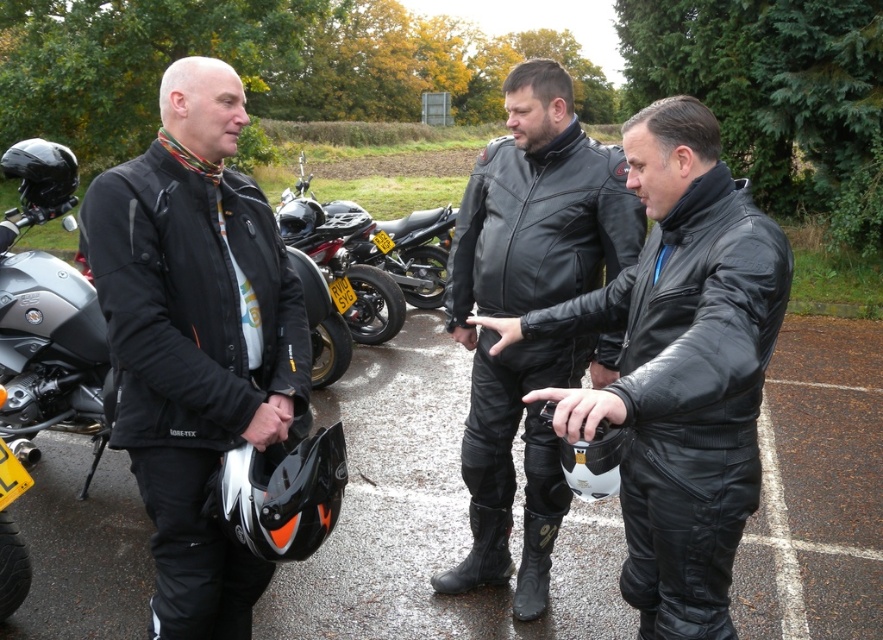
You are a photographer setting up a tripod to take a group photo of the three individuals. The tripod has a height adjustment feature. The black leather jacket at left and the black leather motorcycle at center are both in the frame. Which object should you adjust the tripod height to focus on first to ensure both are in focus?

The black leather jacket at left is taller than the black leather motorcycle at center, so you should adjust the tripod height to focus on the black leather jacket at left first to ensure both are in focus.

You are a parking attendant who needs to fit both the shiny black motorcycle at center and the black leather motorcycle at center into a storage space that can only accommodate a motorcycle with a width of 2 feet. Which motorcycle should you choose to fit into the space?

The shiny black motorcycle at center is thinner than the black leather motorcycle at center, so it would fit into the 2 feet width storage space better.

In the scene shown: You are a photographer trying to capture a group photo of the three individuals. You want to ensure that both the black leather jacket at left and the black leather motorcycle at center are clearly visible in the frame. Given their sizes, which object should you position closer to the camera to maintain clarity and avoid blurriness?

The black leather jacket at left is smaller than the black leather motorcycle at center. To ensure both are clearly visible, position the black leather jacket at left closer to the camera since it is smaller and might otherwise get lost in the background compared to the larger motorcycle.